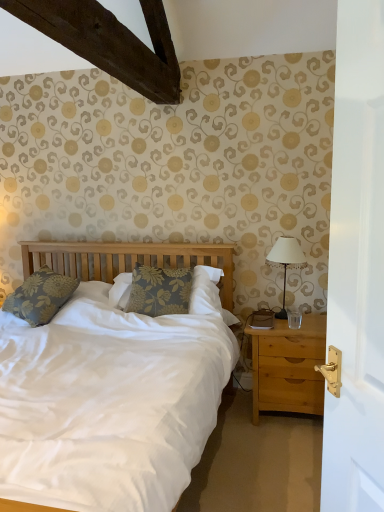
The height and width of the screenshot is (512, 384). In order to click on vacant space situated on the left part of transparent glass at right in this screenshot , I will do `click(282, 330)`.